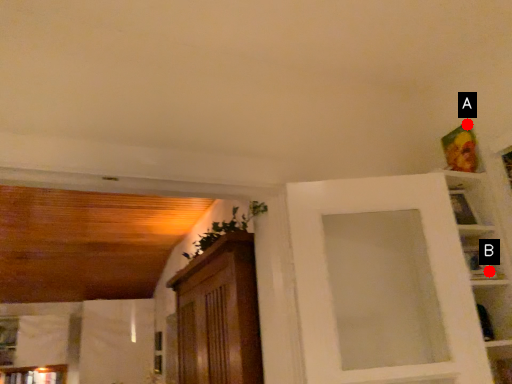
Question: Two points are circled on the image, labeled by A and B beside each circle. Which point is closer to the camera taking this photo?

Choices:
 (A) A is closer
 (B) B is closer

Answer: (B)